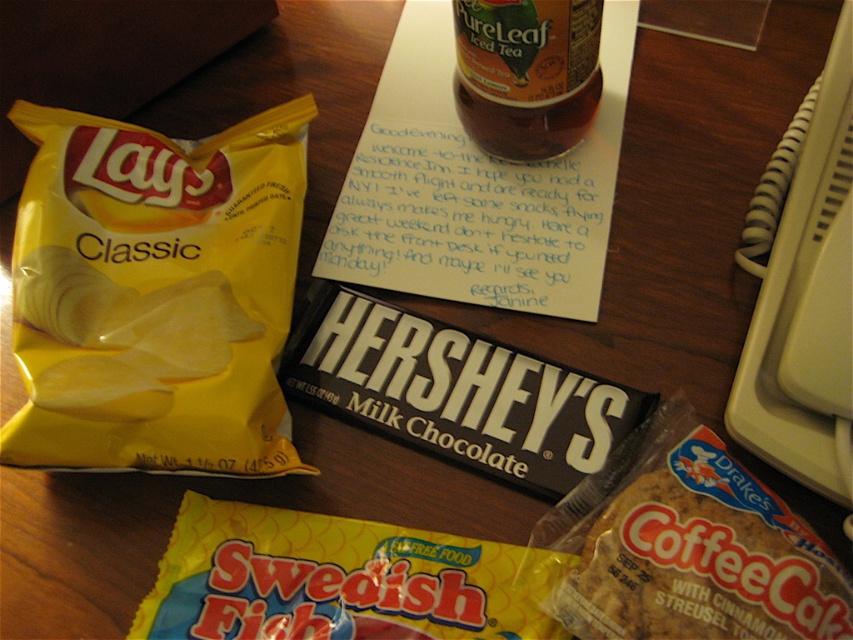
You are organizing snacks on a table and notice the brown crumbly cookie at lower right and the translucent plastic bottle at upper center. Which object is closer to you?

The brown crumbly cookie at lower right is closer to you because it is in front of the translucent plastic bottle at upper center.

You are a person with a 30 cm long arm. You want to reach the brown crumbly cookie at lower right from your current position. Can you reach it?

The brown crumbly cookie at lower right is 38.78 centimeters away from the viewer. Since your arm is only 30 cm long, you cannot reach it without moving closer.

You are looking at the snacks on the wooden surface. There are two points marked on the table. One is at coordinate point (x=253, y=381) and the other is at point (x=312, y=618). Which point is closer to you?

Point (x=312, y=618) is closer to you because point (x=253, y=381) is behind it.